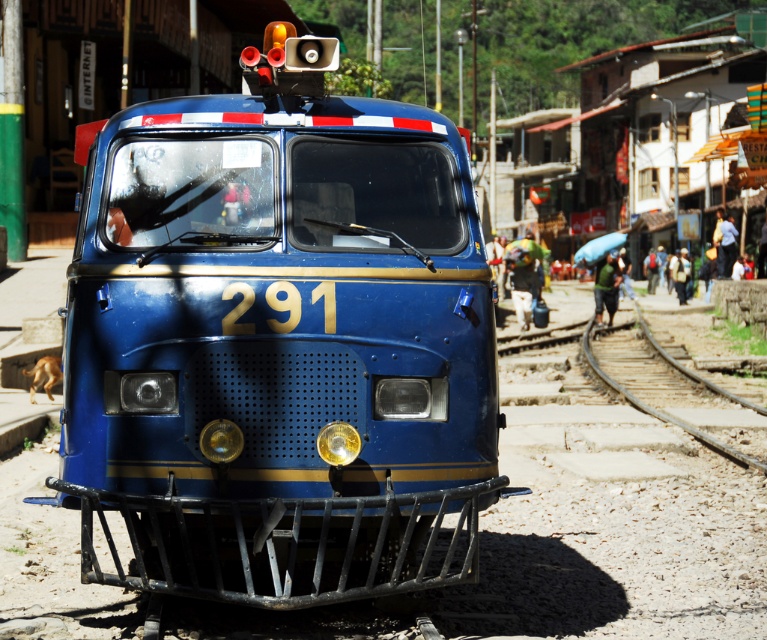
You are a toy train enthusiast who wants to place your matte blue train at center onto the brown wooden train track at lower right. Based on their positions in the image, can you determine if the train will fit on the track?

The matte blue train at center is below the brown wooden train track at lower right, so it is positioned lower than the track. To place the train on the track, you would need to move it upward to reach the track located higher up.

You are a maintenance worker at the railway station. You need to place a new sign that is 1.8 meters tall on a pole. The sign must be placed where it can be seen clearly from both the matte blue train at center and the brown wooden train track at lower right. Considering their heights, where should you position the sign pole?

The matte blue train at center is taller than the brown wooden train track at lower right. To ensure the sign is visible from both, place the pole at a height that exceeds the matte blue train at center, which is the taller object.

You are a toy collector who wants to display your matte blue train at center on the brown wooden train track at lower right. Can the train fit on the track based on their sizes?

The matte blue train at center is smaller than the brown wooden train track at lower right, so it can fit on the track.